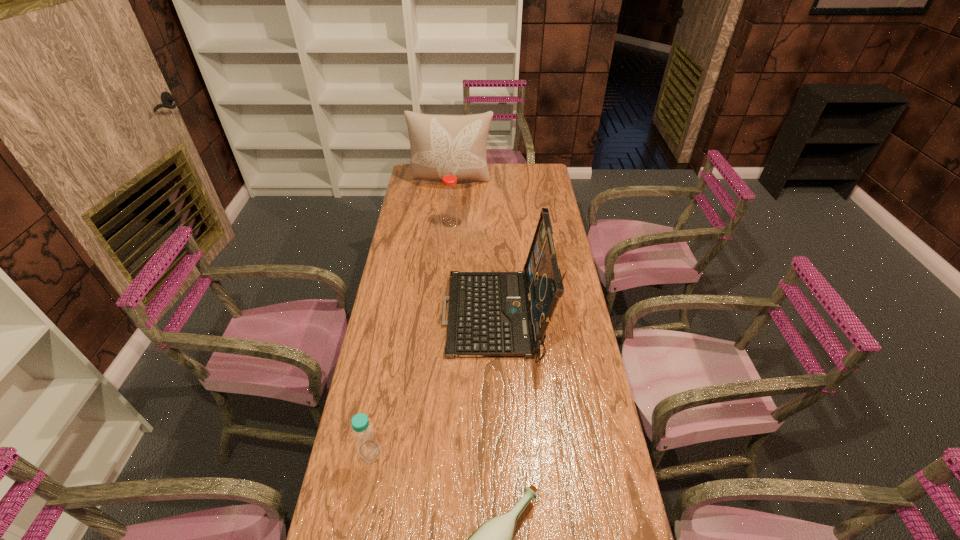
In order to click on free space located 0.400m on the front of the second farthest object in this screenshot , I will do `click(446, 291)`.

Locate an element on the screen. Image resolution: width=960 pixels, height=540 pixels. vacant space situated 0.200m on the back of the fourth tallest object is located at coordinates pos(383,379).

Identify the location of object at the far edge. (441, 145).

I want to click on cushion that is at the left edge, so click(441, 145).

Where is `bottle at the left edge`? Image resolution: width=960 pixels, height=540 pixels. bottle at the left edge is located at coordinates 368,447.

The image size is (960, 540). I want to click on object located in the right edge section of the desktop, so click(x=491, y=314).

Find the location of a particular element. object that is at the far left corner is located at coordinates (441, 145).

You are a GUI agent. You are given a task and a screenshot of the screen. Output one action in this format:
    pyautogui.click(x=<x>, y=<y>)
    Task: Click on the vacant space at the left edge
    This screenshot has height=540, width=960.
    Given the screenshot: What is the action you would take?
    pyautogui.click(x=407, y=293)

You are a GUI agent. You are given a task and a screenshot of the screen. Output one action in this format:
    pyautogui.click(x=<x>, y=<y>)
    Task: Click on the free space at the right edge of the desktop
    
    Given the screenshot: What is the action you would take?
    pyautogui.click(x=569, y=533)

Locate an element on the screen. unoccupied position between the third farthest object and the cushion is located at coordinates (474, 249).